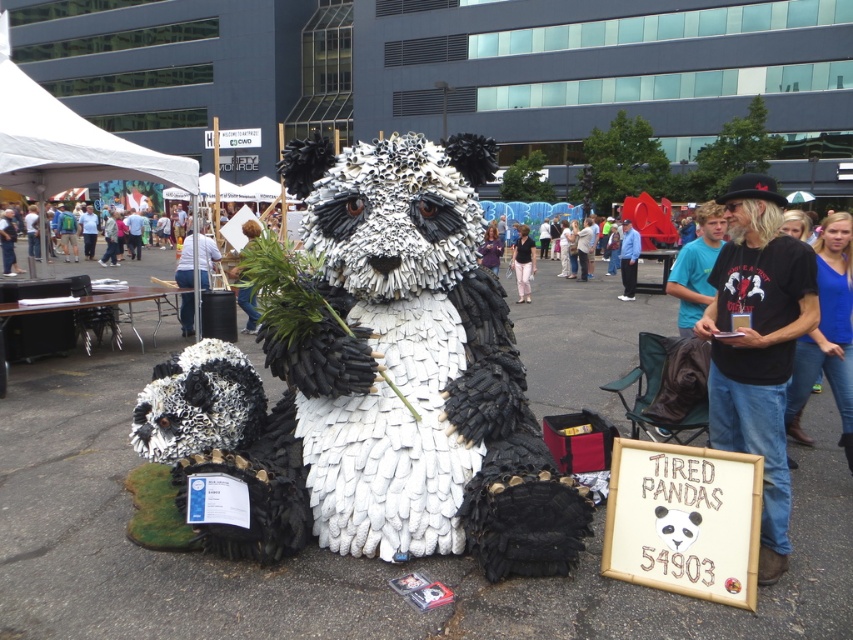
You are standing at the center of the image and want to find the blue cotton shirt at right. In which direction should you look to see it?

You should look to the right because the blue cotton shirt at right is located at point [828,328], which is to the right side of the image.

You are at the festival and want to find the blue cotton shirt at right. According to the coordinates provided, where should you look?

You should look at point [828,328] to find the blue cotton shirt at right.